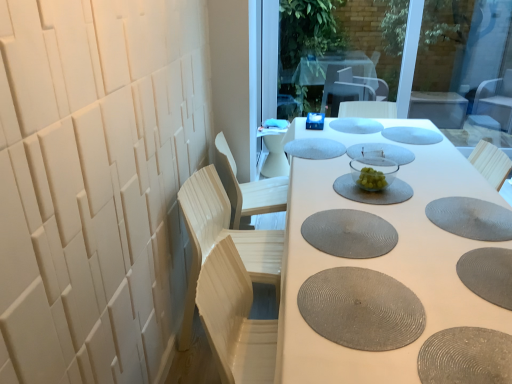
At what (x,y) coordinates should I click in order to perform the action: click on vacant space situated on the left part of clear glass bowl at center, which is the fourth manhole cover in back-to-front order. Please return your answer as a coordinate pair (x, y). Looking at the image, I should click on (320, 151).